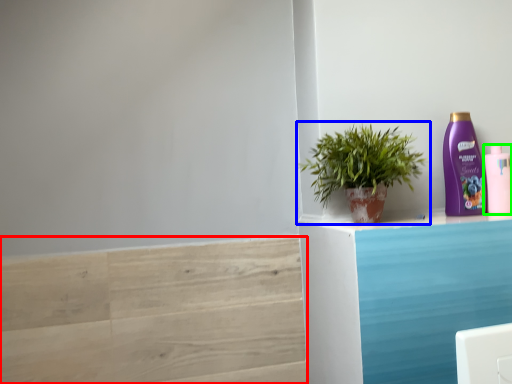
Question: Which object is positioned farthest from stair (highlighted by a red box)? Select from houseplant (highlighted by a blue box) and bottle (highlighted by a green box).

Choices:
 (A) houseplant
 (B) bottle

Answer: (B)